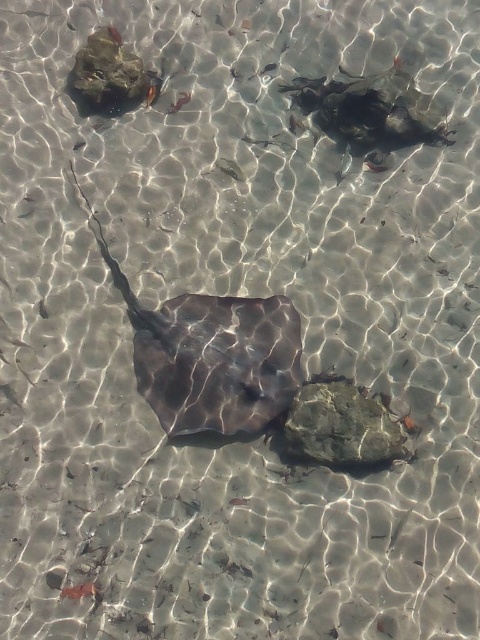
You are a diver swimming underwater and want to reach the point at coordinates point (202, 394) from point (331, 406). Which direction should you swim to get there?

To reach point (202, 394) from point (331, 406), you should swim upwards because point (202, 394) is behind point (331, 406), which in an underwater perspective would mean moving towards the surface.

From the picture: You are a marine biologist observing the underwater scene. You notice the smooth dark gray stingray at center and the green mossy rock at center. Which object is positioned higher in the water column?

The smooth dark gray stingray at center is located above the green mossy rock at center, so it is positioned higher in the water column.

You are a marine biologist observing the underwater scene. You need to determine which object is wider between the smooth dark gray stingray at center and the green mossy rock at center. Based on the scene, which one is wider?

The smooth dark gray stingray at center is wider than the green mossy rock at center.